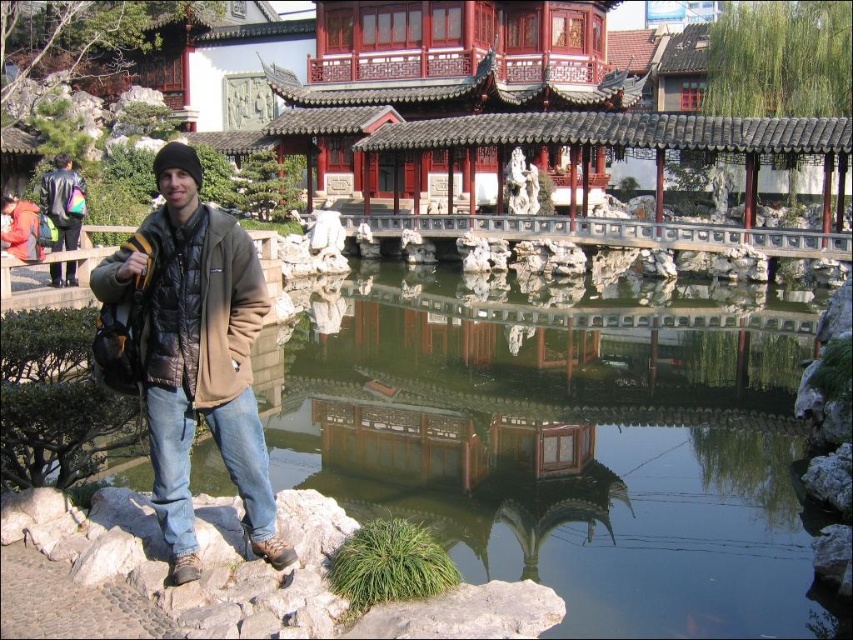
You are a photographer planning to capture the serene scene of the traditional Chinese garden. You have a camera with a wide angle lens. Considering the transparent water at center and the gray rock at lower left, which object would better utilize the wide angle lens to capture more details due to its size?

The transparent water at center is larger in size than the gray rock at lower left, so using a wide angle lens would better capture more details of the transparent water at center.

You are standing in the traditional Chinese garden and want to take a photo of the gray rock at lower left and the matte black jacket at left. Which object should you focus on first if you want to capture both in the same frame without moving the camera?

You should focus on the gray rock at lower left first because it is closer to the viewer than the matte black jacket at left, so adjusting focus to the closer object ensures both will be in the frame.